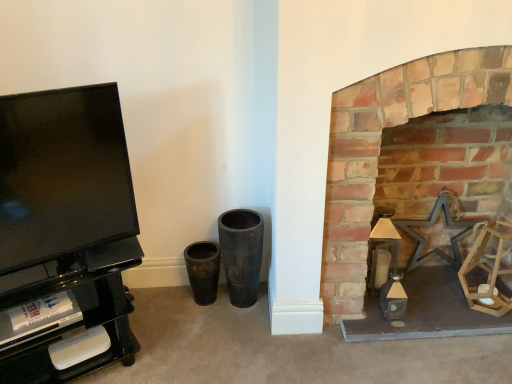
Question: Considering their positions, is black glossy tv stand at left located in front of or behind brick fireplace at right?

Choices:
 (A) front
 (B) behind

Answer: (A)

Question: Is black glossy tv stand at left situated inside brick fireplace at right or outside?

Choices:
 (A) outside
 (B) inside

Answer: (A)

Question: In the image, is black glossy tv stand at left on the left side or the right side of brick fireplace at right?

Choices:
 (A) left
 (B) right

Answer: (A)

Question: Is brick fireplace at right bigger or smaller than black glossy tv stand at left?

Choices:
 (A) small
 (B) big

Answer: (B)

Question: From the image's perspective, is brick fireplace at right above or below black glossy tv stand at left?

Choices:
 (A) above
 (B) below

Answer: (A)

Question: Is brick fireplace at right situated inside black glossy tv stand at left or outside?

Choices:
 (A) inside
 (B) outside

Answer: (B)

Question: From a real-world perspective, is brick fireplace at right positioned above or below black glossy tv stand at left?

Choices:
 (A) below
 (B) above

Answer: (A)